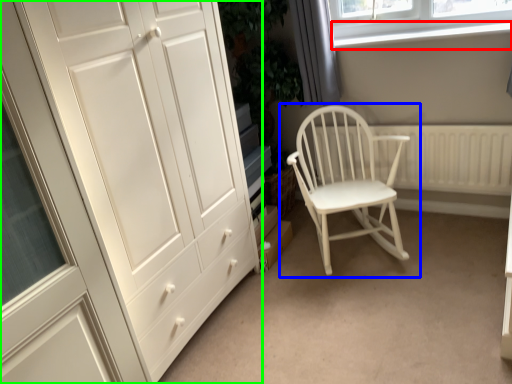
Question: Based on their relative distances, which object is farther from window sill (highlighted by a red box)? Choose from chair (highlighted by a blue box) and cupboard (highlighted by a green box).

Choices:
 (A) chair
 (B) cupboard

Answer: (B)